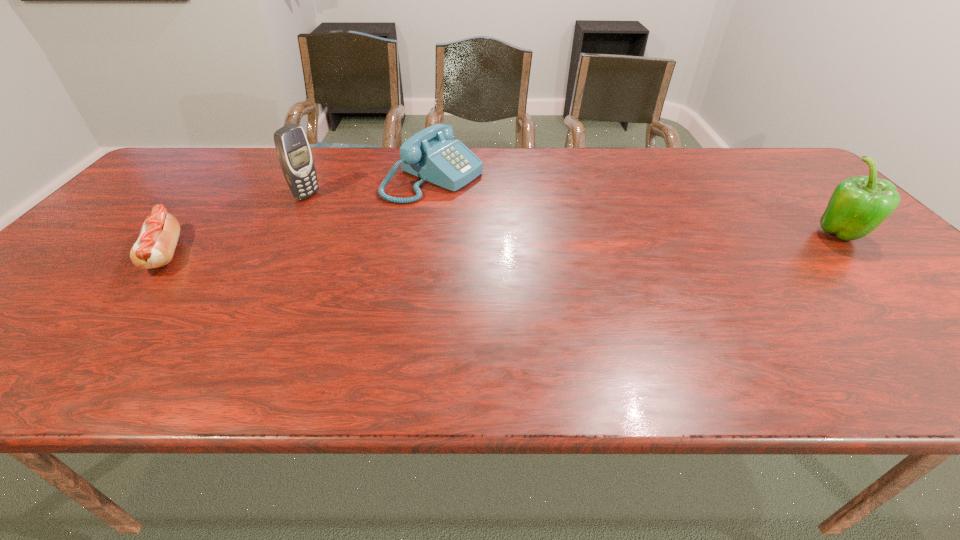
At what (x,y) coordinates should I click in order to perform the action: click on sausage. Please return your answer as a coordinate pair (x, y). This screenshot has height=540, width=960. Looking at the image, I should click on (155, 246).

Locate an element on the screen. The width and height of the screenshot is (960, 540). the leftmost object is located at coordinates (155, 246).

I want to click on the rightmost object, so click(858, 205).

Image resolution: width=960 pixels, height=540 pixels. Find the location of `the third tallest object`. the third tallest object is located at coordinates (431, 154).

Image resolution: width=960 pixels, height=540 pixels. What are the coordinates of `the second object from right to left` in the screenshot? It's located at (431, 154).

At what (x,y) coordinates should I click in order to perform the action: click on the second object from left to right. Please return your answer as a coordinate pair (x, y). This screenshot has width=960, height=540. Looking at the image, I should click on (294, 154).

Locate an element on the screen. This screenshot has height=540, width=960. vacant position located 0.190m on the right of the leftmost object is located at coordinates (266, 253).

This screenshot has width=960, height=540. I want to click on vacant point located on the left of the bell pepper, so click(x=703, y=236).

Identify the location of free space located 0.390m on the dial of the third object from left to right. This screenshot has width=960, height=540. (597, 241).

What are the coordinates of `blank space located 0.370m on the dial of the third object from left to right` in the screenshot? It's located at (590, 238).